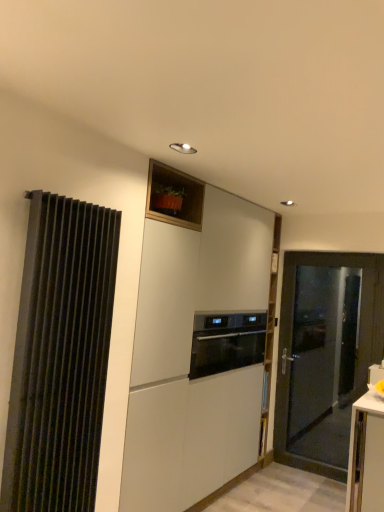
Question: Is black ribbed curtain at left wider or thinner than white matte cabinet at center?

Choices:
 (A) thin
 (B) wide

Answer: (A)

Question: Based on their sizes in the image, would you say black ribbed curtain at left is bigger or smaller than white matte cabinet at center?

Choices:
 (A) big
 (B) small

Answer: (B)

Question: Estimate the real-world distances between objects in this image. Which object is farther from the white matte cabinet at center?

Choices:
 (A) black glass oven at center
 (B) black ribbed curtain at left
 (C) matte black door at right

Answer: (C)

Question: Which object is the farthest from the black glass oven at center?

Choices:
 (A) matte black door at right
 (B) white matte cabinet at center
 (C) black ribbed curtain at left

Answer: (C)